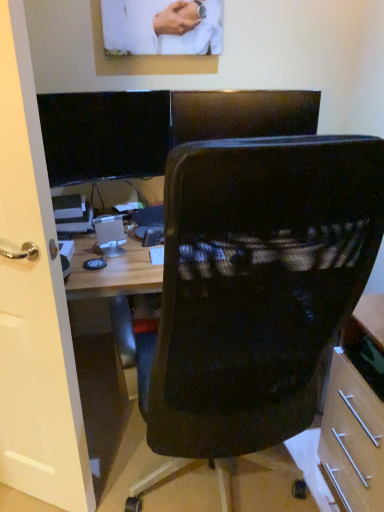
The image size is (384, 512). What are the coordinates of `empty space that is to the right of white glossy door at left` in the screenshot? It's located at (120, 473).